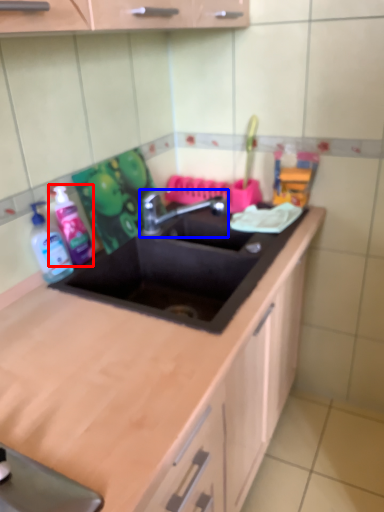
Question: Which object appears farthest to the camera in this image, cleaning product (highlighted by a red box) or tap (highlighted by a blue box)?

Choices:
 (A) cleaning product
 (B) tap

Answer: (B)